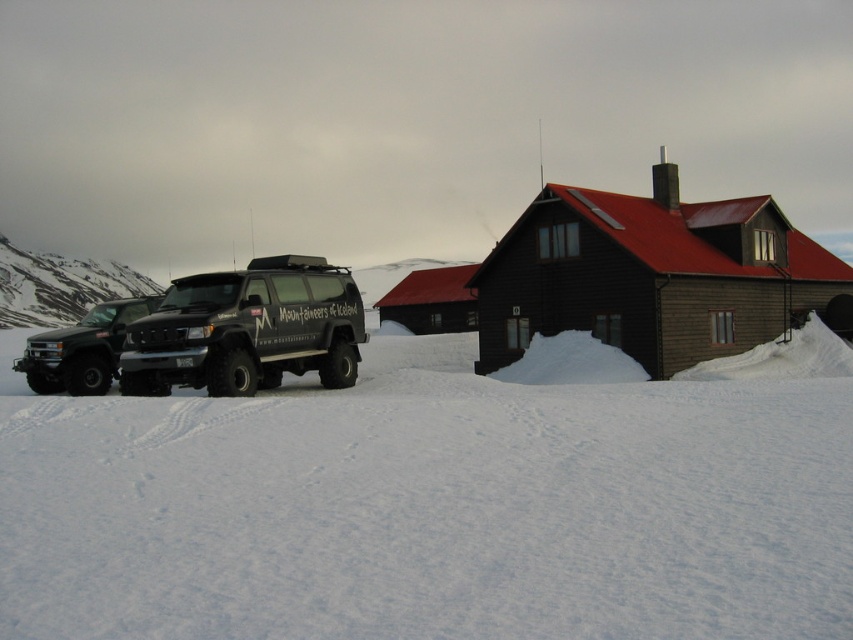
You are a delivery driver who needs to park your vehicle. You see the matte black van at center and the matte black truck at left. Which vehicle is blocking your path to the parking spot?

The matte black van at center is positioned over the matte black truck at left, so the matte black van at center is blocking your path to the parking spot.

You are a delivery driver who needs to back out of the parking area in front of the wooden building with a red roof. You are currently positioned between the matte black van at center and the matte black truck at left. Which vehicle should you move around to exit safely without hitting any obstacles?

The matte black van at center is in front of the matte black truck at left, so you should move around the matte black truck at left since it is further back and allows more space to maneuver out of the parking area safely.

You are standing in front of the wooden building with a red roof. You need to walk to the matte black truck at left. Is the white powdery snow at center between you and the truck?

The white powdery snow at center is closer to the viewer than matte black truck at left, so yes, the snow is between you and the truck.